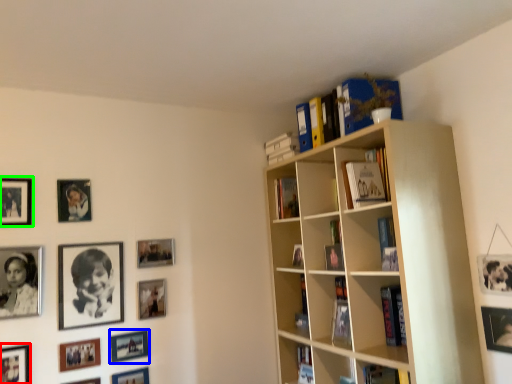
Question: Estimate the real-world distances between objects in this image. Which object is farther from picture frame (highlighted by a red box), picture frame (highlighted by a blue box) or picture frame (highlighted by a green box)?

Choices:
 (A) picture frame
 (B) picture frame

Answer: (B)